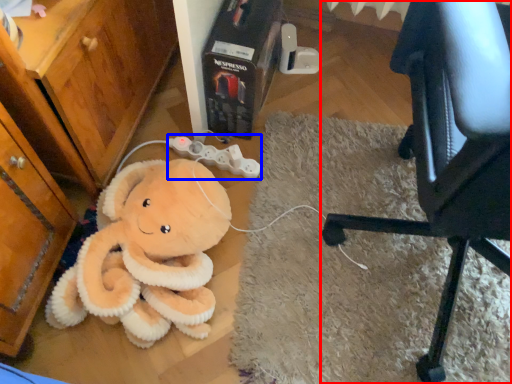
Question: Which object appears farthest to the camera in this image, chair (highlighted by a red box) or game controller (highlighted by a blue box)?

Choices:
 (A) chair
 (B) game controller

Answer: (B)